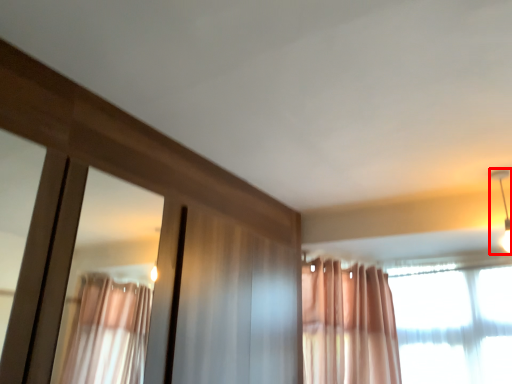
Question: From the image's perspective, considering the relative positions of light fixture (annotated by the red box) and curtain in the image provided, where is light fixture (annotated by the red box) located with respect to the staircase?

Choices:
 (A) above
 (B) below

Answer: (A)